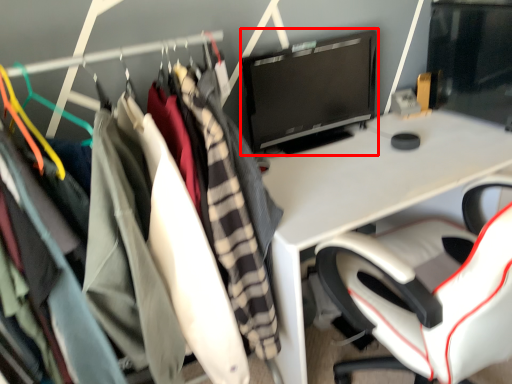
Question: From the image's perspective, where is computer monitor (annotated by the red box) located relative to clothing?

Choices:
 (A) below
 (B) above

Answer: (B)